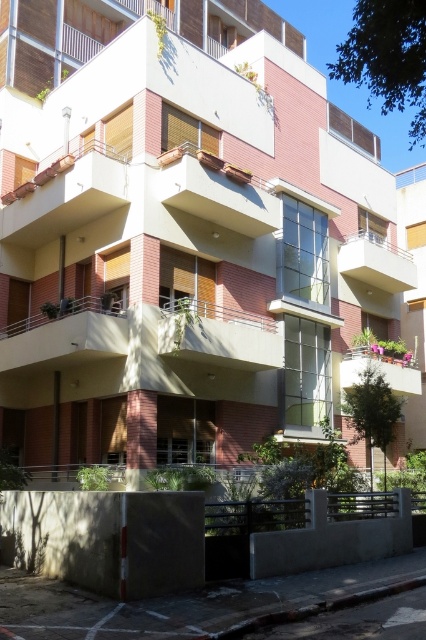
Can you confirm if white concrete balcony at upper center is bigger than matte white balcony at lower right?

Yes, white concrete balcony at upper center is bigger than matte white balcony at lower right.

Between point (357, 269) and point (348, 376), which one is positioned behind?

The point (357, 269) is more distant.

You are a GUI agent. You are given a task and a screenshot of the screen. Output one action in this format:
    pyautogui.click(x=<x>, y=<y>)
    Task: Click on the white concrete balcony at upper center
    
    Given the screenshot: What is the action you would take?
    pyautogui.click(x=377, y=262)

Between matte concrete balcony at center and matte white balcony at lower right, which one is positioned lower?

matte white balcony at lower right is lower down.

Does matte concrete balcony at center have a lesser width compared to matte white balcony at lower right?

Yes.

Which is behind, point (218, 182) or point (359, 371)?

Positioned behind is point (359, 371).

Identify the location of matte concrete balcony at center. (216, 193).

Can you confirm if smooth concrete balcony at center is smaller than matte concrete balcony at center?

Indeed, smooth concrete balcony at center has a smaller size compared to matte concrete balcony at center.

Consider the image. Is smooth concrete balcony at center positioned before matte concrete balcony at center?

Yes, smooth concrete balcony at center is closer to the viewer.

Describe the element at coordinates (218, 336) in the screenshot. I see `smooth concrete balcony at center` at that location.

This screenshot has width=426, height=640. Find the location of `smooth concrete balcony at center`. smooth concrete balcony at center is located at coordinates (218, 336).